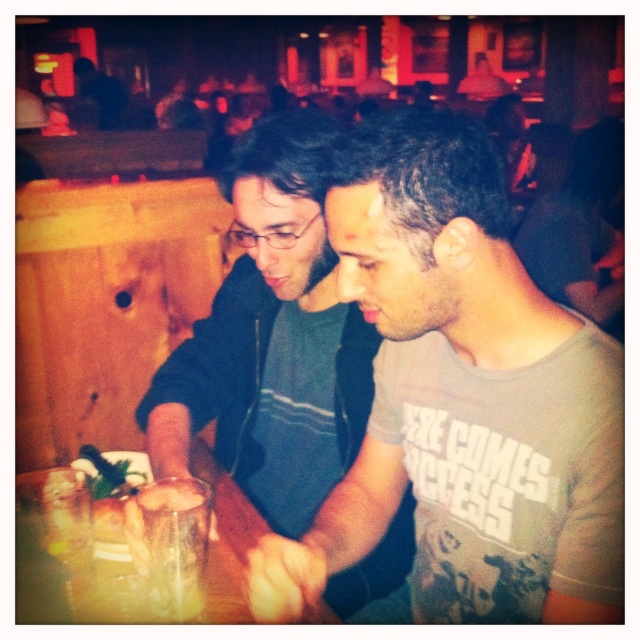
Which is more to the left, matte black shirt at center or dark gray t-shirt at upper right?

Positioned to the left is matte black shirt at center.

Can you confirm if matte black shirt at center is positioned below dark gray t-shirt at upper right?

Yes.

Is point (310, 362) behind point (595, 176)?

No, (310, 362) is closer to viewer.

Where is `matte black shirt at center`? matte black shirt at center is located at coordinates (272, 339).

Which is above, translucent glass table at center or dark gray t-shirt at upper right?

dark gray t-shirt at upper right is higher up.

Is translucent glass table at center thinner than dark gray t-shirt at upper right?

In fact, translucent glass table at center might be wider than dark gray t-shirt at upper right.

Which is in front, point (88, 596) or point (566, 230)?

Point (88, 596) is more forward.

Locate an element on the screen. translucent glass table at center is located at coordinates (76, 522).

Who is lower down, dark gray t-shirt at upper right or green leafy vegetable at center?

Positioned lower is green leafy vegetable at center.

Does point (582, 280) come in front of point (134, 472)?

No.

Measure the distance between dark gray t-shirt at upper right and camera.

dark gray t-shirt at upper right is 2.16 meters away from camera.

The width and height of the screenshot is (640, 640). What are the coordinates of `dark gray t-shirt at upper right` in the screenshot? It's located at (579, 227).